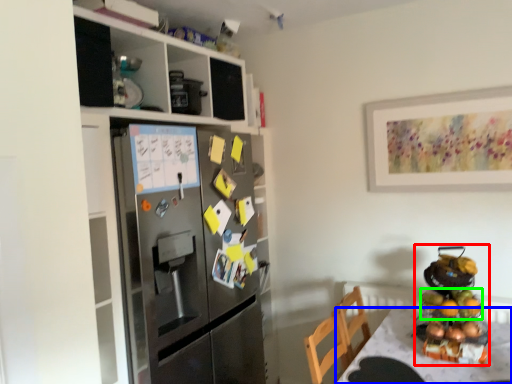
Question: Which object is the closest to the appliance (highlighted by a red box)? Choose among these: desk (highlighted by a blue box) or fruit (highlighted by a green box).

Choices:
 (A) desk
 (B) fruit

Answer: (B)